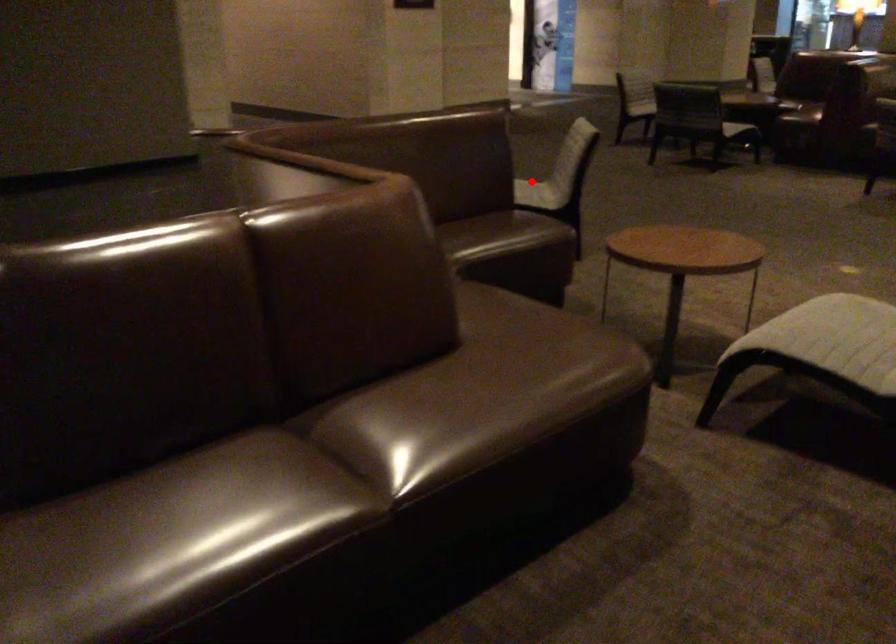
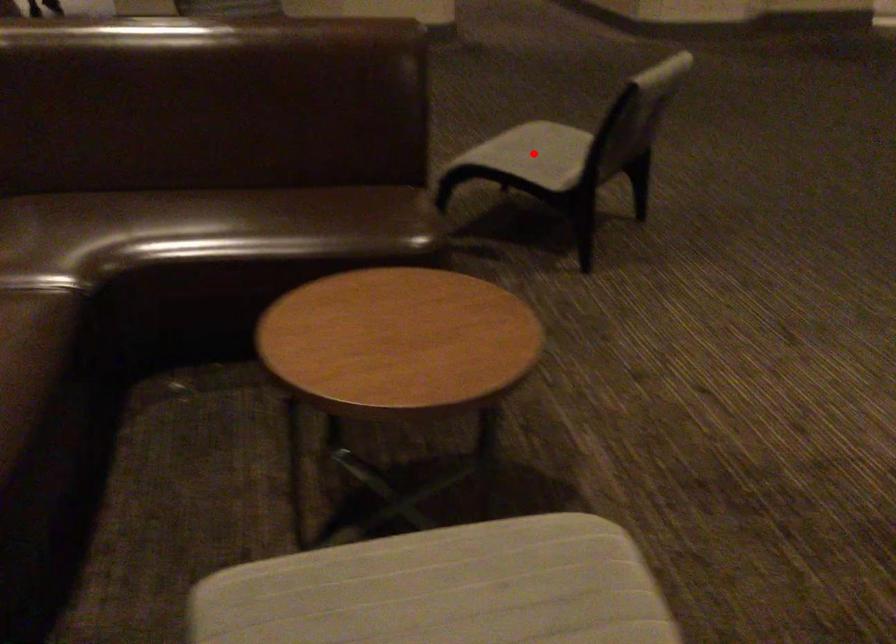
I am providing you with two images of the same scene from different viewpoints. A red point is marked on the first image and another point is marked on the second image. Do the highlighted points in image1 and image2 indicate the same real-world spot?

Yes